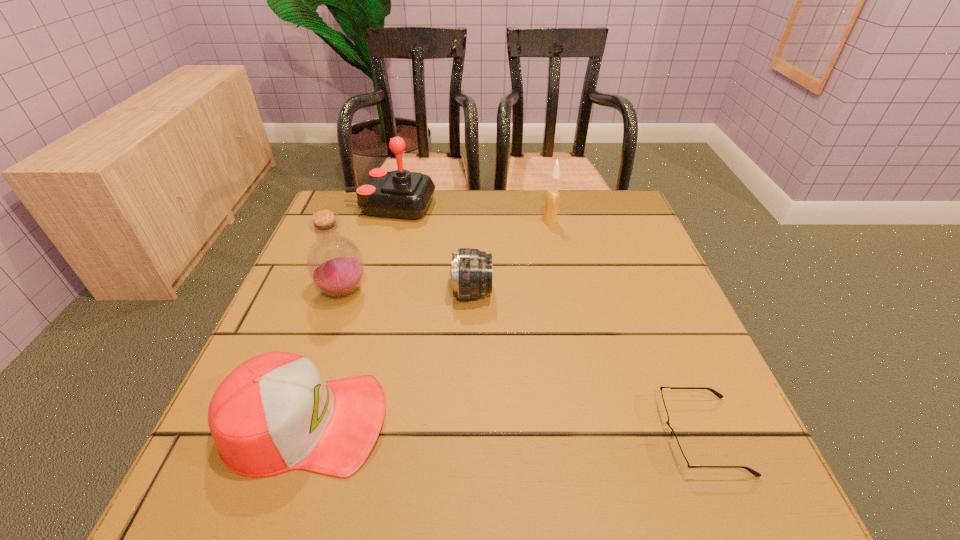
You are a GUI agent. You are given a task and a screenshot of the screen. Output one action in this format:
    pyautogui.click(x=<x>, y=<y>)
    Task: Click on the free spot between the joystick and the bottle
    This screenshot has height=540, width=960.
    Given the screenshot: What is the action you would take?
    pyautogui.click(x=367, y=248)

Identify the location of unoccupied area between the candle and the baseball cap. (428, 322).

Locate an element on the screen. The width and height of the screenshot is (960, 540). vacant space in between the joystick and the shortest object is located at coordinates (546, 321).

At what (x,y) coordinates should I click in order to perform the action: click on object that can be found as the third closest to the joystick. Please return your answer as a coordinate pair (x, y). Looking at the image, I should click on (552, 196).

You are a GUI agent. You are given a task and a screenshot of the screen. Output one action in this format:
    pyautogui.click(x=<x>, y=<y>)
    Task: Click on the object that ranks as the closest to the rightmost object
    Image resolution: width=960 pixels, height=540 pixels.
    Given the screenshot: What is the action you would take?
    pyautogui.click(x=471, y=269)

This screenshot has height=540, width=960. Find the location of `free location that satisfies the following two spatial constraints: 1. on the front side of the second object from right to left; 2. on the front-facing side of the baseball cap`. free location that satisfies the following two spatial constraints: 1. on the front side of the second object from right to left; 2. on the front-facing side of the baseball cap is located at coordinates (592, 422).